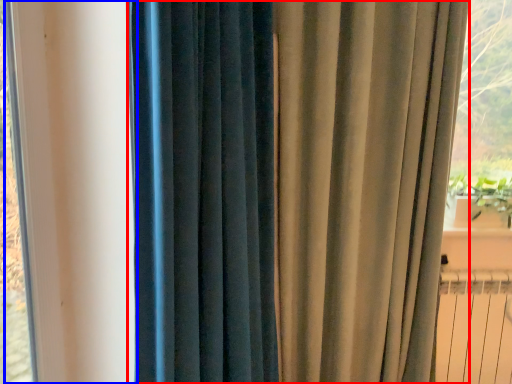
Question: Which object appears farthest to the camera in this image, curtain (highlighted by a red box) or window frame (highlighted by a blue box)?

Choices:
 (A) curtain
 (B) window frame

Answer: (A)